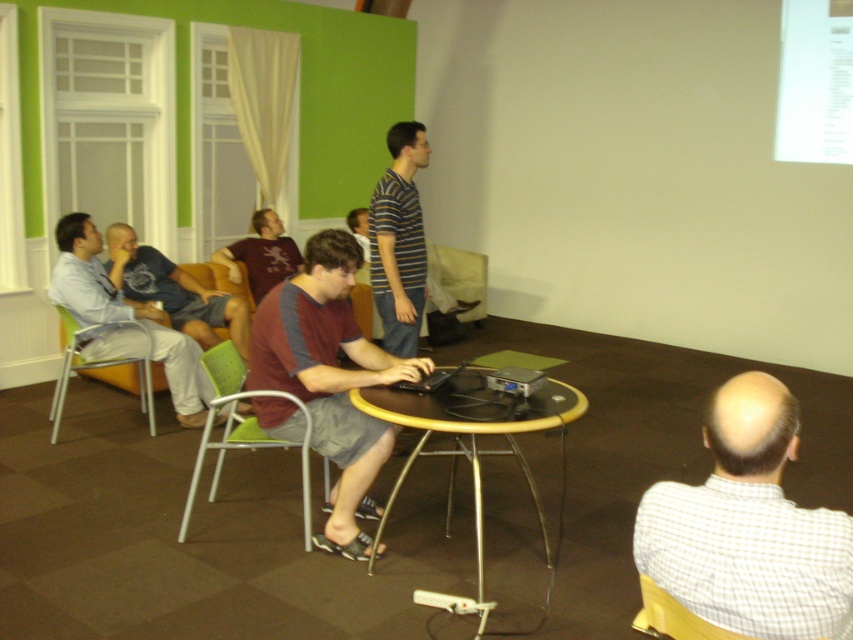
Question: Observing the image, what is the correct spatial positioning of white checkered shirt at lower right in reference to matte black laptop at center?

Choices:
 (A) below
 (B) above

Answer: (A)

Question: Does light blue cotton shirt at left have a greater width compared to green fabric chair at lower left?

Choices:
 (A) no
 (B) yes

Answer: (B)

Question: Which point is closer to the camera taking this photo?

Choices:
 (A) (131, 326)
 (B) (225, 420)
 (C) (701, 621)

Answer: (C)

Question: Among these points, which one is nearest to the camera?

Choices:
 (A) (254, 416)
 (B) (675, 628)

Answer: (B)

Question: Which of the following is the farthest from the observer?

Choices:
 (A) [399, 296]
 (B) [274, 372]
 (C) [527, 476]
 (D) [708, 576]

Answer: (A)

Question: Can you confirm if maroon fabric shirt at center is bigger than maroon jersey at center?

Choices:
 (A) no
 (B) yes

Answer: (B)